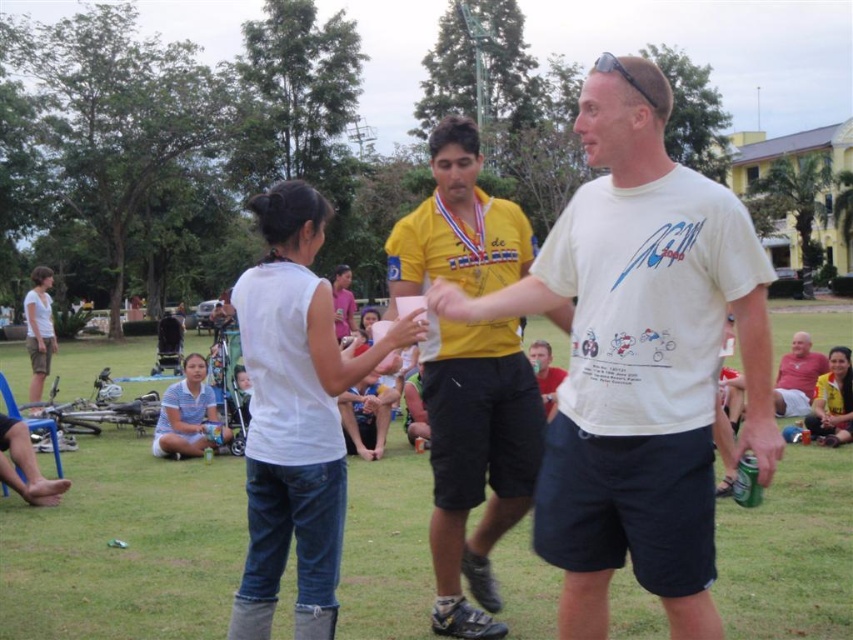
Which is behind, point (795, 353) or point (532, 355)?

Point (795, 353)

Which is in front, point (792, 390) or point (548, 381)?

Point (548, 381) is in front.

Locate an element on the screen. This screenshot has height=640, width=853. white matte shirt at center is located at coordinates pyautogui.click(x=798, y=376).

Between white cotton t-shirt at center and yellow matte shirt at center, which one appears on the right side from the viewer's perspective?

Positioned to the right is white cotton t-shirt at center.

Is point (761, 422) in front of point (480, 428)?

Yes, it is.

The width and height of the screenshot is (853, 640). I want to click on white cotton t-shirt at center, so click(639, 358).

Is yellow matte shirt at center taller than matte red shirt at center?

Yes, yellow matte shirt at center is taller than matte red shirt at center.

The image size is (853, 640). Find the location of `yellow matte shirt at center`. yellow matte shirt at center is located at coordinates [476, 460].

Who is more forward, (x=494, y=490) or (x=555, y=369)?

Positioned in front is point (x=494, y=490).

You are a GUI agent. You are given a task and a screenshot of the screen. Output one action in this format:
    pyautogui.click(x=<x>, y=<y>)
    Task: Click on the yellow matte shirt at center
    The image size is (853, 640).
    Given the screenshot: What is the action you would take?
    pyautogui.click(x=476, y=460)